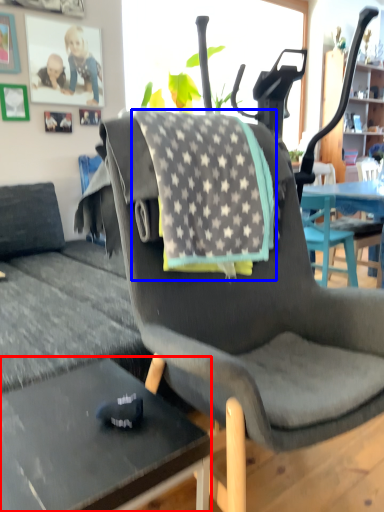
Question: Which of the following is the closest to the observer, desk (highlighted by a red box) or blanket (highlighted by a blue box)?

Choices:
 (A) desk
 (B) blanket

Answer: (A)